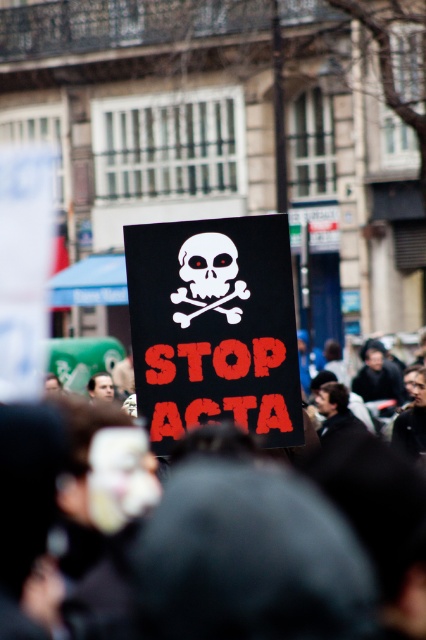
You are a photographer trying to capture the white matte skull at center in the protest scene. The black fabric crowd at center is blocking your view. Based on the scene description, can you determine if the skull is visible above the crowd?

The black fabric crowd at center is taller than the white matte skull at center, so the skull is not visible above the crowd.

You are a photographer standing at the edge of the protest. You want to take a photo that includes both the black fabric crowd at center and the white matte skull at center. Given the distance between them, will you need to adjust your camera to a wider angle to capture both in the frame?

The distance between the black fabric crowd at center and the white matte skull at center is 30.76 feet. To capture both in the frame, you would need to adjust your camera to a wider angle to accommodate the 30.76 feet gap between them.

You are a photographer trying to capture the black matte placard at center in your shot. The camera you are using has a focal point at coordinates 0.5, 0.5. Will the placard be centered in your photo?

The black matte placard at center is located at point (x=213, y=326), which is very close to the camera focal point at (x=213, y=320). Therefore, the placard will be nearly centered in the photo.